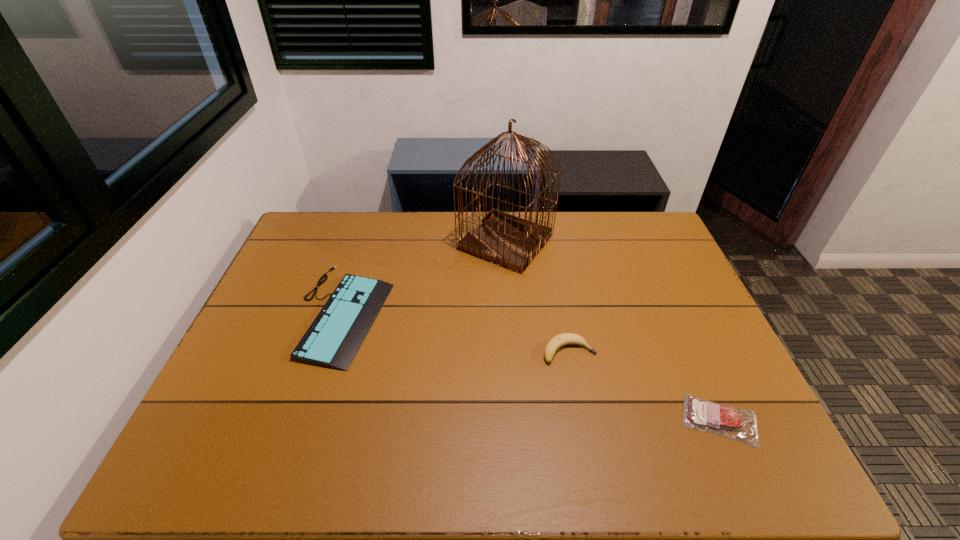
Find the location of a particular element. birdcage is located at coordinates (511, 242).

This screenshot has width=960, height=540. Identify the location of the third shortest object. pyautogui.click(x=555, y=343).

Find the location of a particular element. computer keyboard is located at coordinates (x=333, y=339).

The image size is (960, 540). Identify the location of the leftmost object. (333, 339).

This screenshot has height=540, width=960. Find the location of `the shortest object`. the shortest object is located at coordinates (739, 424).

You are a GUI agent. You are given a task and a screenshot of the screen. Output one action in this format:
    pyautogui.click(x=<x>, y=<y>)
    Task: Click on the nearest object
    Image resolution: width=960 pixels, height=540 pixels.
    Given the screenshot: What is the action you would take?
    pyautogui.click(x=739, y=424)

Identify the location of vacant space located 0.100m on the left of the birdcage. The image size is (960, 540). (428, 242).

Where is `free space located 0.080m on the front of the second tallest object`? The height and width of the screenshot is (540, 960). free space located 0.080m on the front of the second tallest object is located at coordinates (577, 392).

Locate an element on the screen. This screenshot has width=960, height=540. free space located 0.400m on the right of the third tallest object is located at coordinates (525, 313).

What are the coordinates of `vacant region located on the left of the rightmost object` in the screenshot? It's located at tap(539, 420).